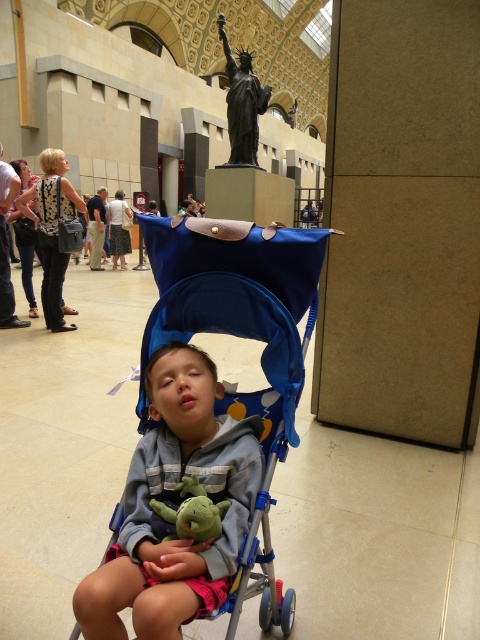
Question: Which point is closer to the camera?

Choices:
 (A) (168, 445)
 (B) (188, 506)

Answer: (B)

Question: Does blue fabric baby carriage at center appear under gray fleece jacket at center?

Choices:
 (A) yes
 (B) no

Answer: (B)

Question: Does blue fabric baby carriage at center have a lesser width compared to bronze statue at center?

Choices:
 (A) no
 (B) yes

Answer: (A)

Question: Which is nearer to the green plush toy at center?

Choices:
 (A) bronze statue at center
 (B) gray fleece jacket at center

Answer: (B)

Question: Which of the following is the farthest from the observer?

Choices:
 (A) green plush toy at center
 (B) bronze statue at center
 (C) blue fabric baby carriage at center
 (D) gray fleece jacket at center

Answer: (B)

Question: Does gray fleece jacket at center have a lesser width compared to bronze statue at center?

Choices:
 (A) yes
 (B) no

Answer: (B)